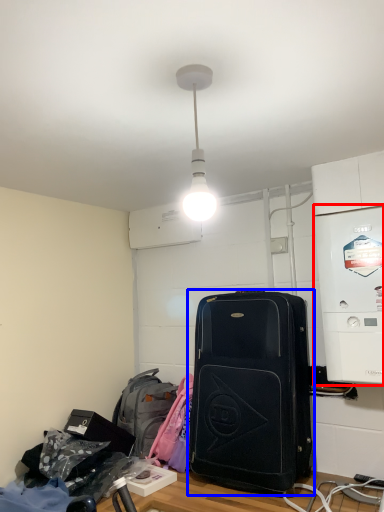
Question: Which object is further to the camera taking this photo, appliance (highlighted by a red box) or luggage and bags (highlighted by a blue box)?

Choices:
 (A) appliance
 (B) luggage and bags

Answer: (B)